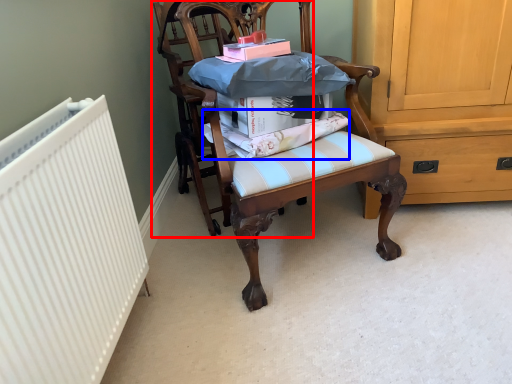
Question: Among these objects, which one is nearest to the camera, chair (highlighted by a red box) or fabric (highlighted by a blue box)?

Choices:
 (A) chair
 (B) fabric

Answer: (B)